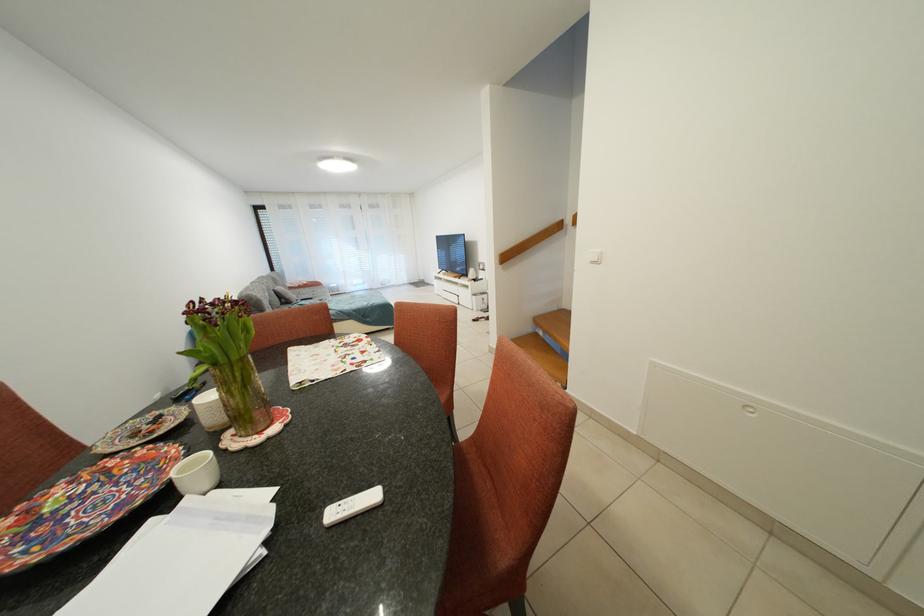
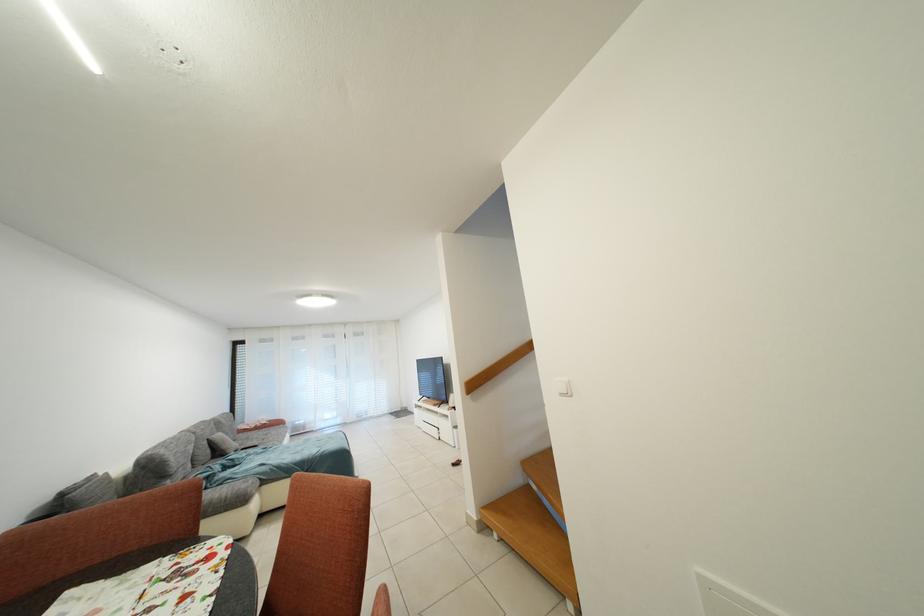
Question: Based on the continuous images, in which direction is the camera rotating? Reply with the corresponding letter.

Choices:
 (A) Left
 (B) Right
 (C) Up
 (D) Down

Answer: (C)